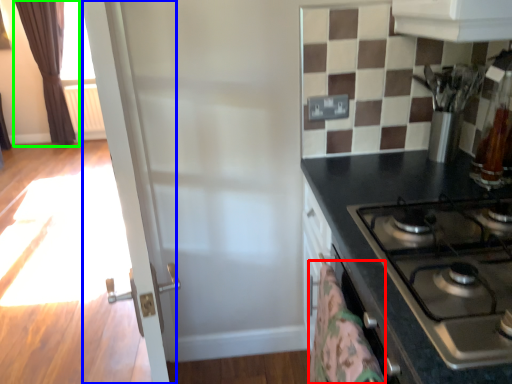
Question: Based on their relative distances, which object is farther from blanket (highlighted by a red box)? Choose from screen door (highlighted by a blue box) and curtain (highlighted by a green box).

Choices:
 (A) screen door
 (B) curtain

Answer: (B)